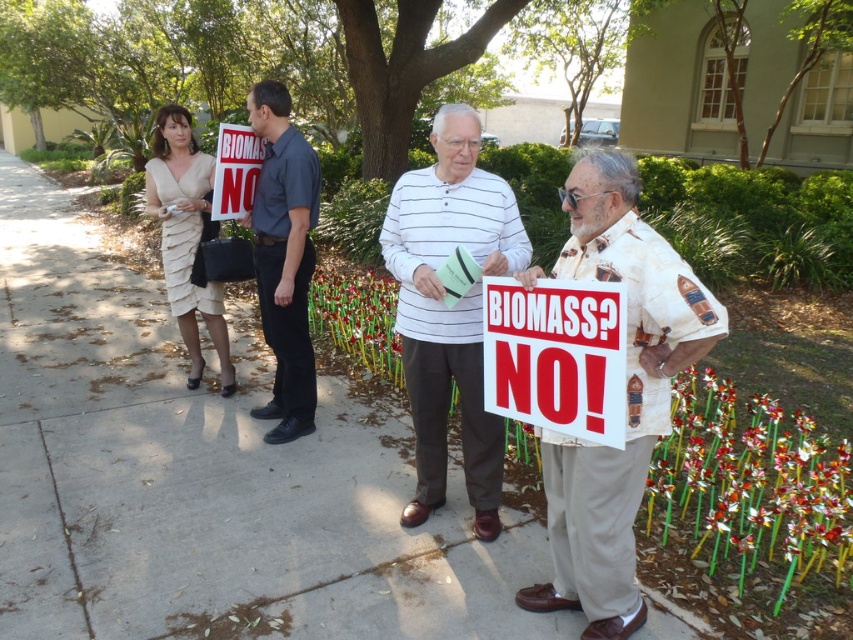
From the picture: You are a pedestrian walking towards the beige printed shirt at right and the concrete sidewalk at center. Which object will you encounter first?

The concrete sidewalk at center is closer to you than the beige printed shirt at right, so you will encounter the concrete sidewalk at center first.

You are standing at the center of the image. Which direction should you look to see the beige printed shirt at right?

The beige printed shirt at right is located at the right side of the image, so you should look to your right to see it.

You are a photographer trying to capture the protestor holding the sign that reads BIOMASS? NO! in bold red letters. You notice a beige printed shirt at right near the point marked at coordinates (625, 394). Is this beige printed shirt at right part of the same protest group as the man with the sign?

The beige printed shirt at right is located at the point marked at coordinates (625, 394), which is near the man holding the sign. Since they are in close proximity, it is likely that the beige printed shirt at right belongs to the same protest group as the man with the sign.